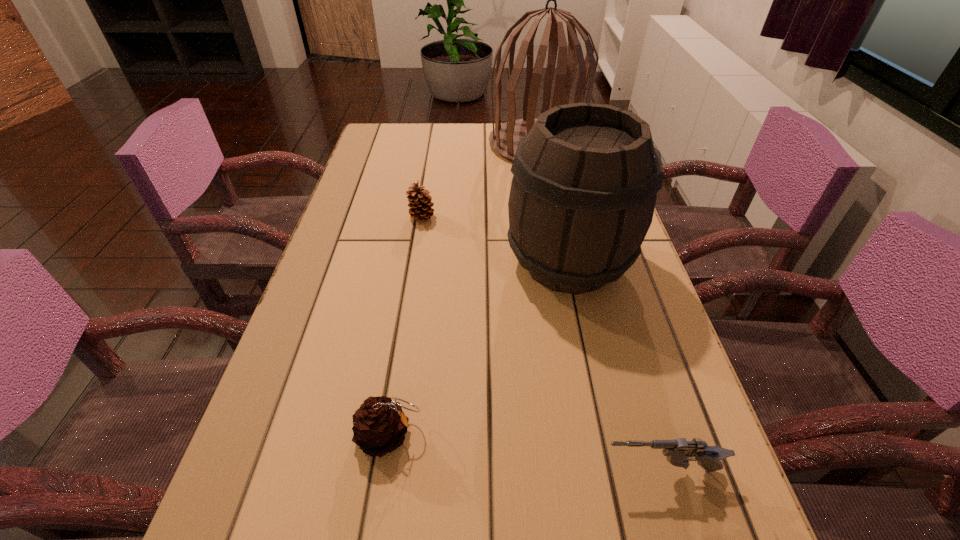
Locate an element on the screen. The width and height of the screenshot is (960, 540). vacant region located at the barrel of the nearest object is located at coordinates (423, 470).

Find the location of a particular element. blank space located at the barrel of the nearest object is located at coordinates (547, 470).

Find the location of `free space located 0.160m at the barrel of the nearest object`. free space located 0.160m at the barrel of the nearest object is located at coordinates pyautogui.click(x=495, y=470).

The height and width of the screenshot is (540, 960). Identify the location of object that is at the far edge. (504, 139).

The image size is (960, 540). In order to click on birdcage located in the right edge section of the desktop in this screenshot , I will do `click(504, 139)`.

At what (x,y) coordinates should I click in order to perform the action: click on wine bucket positioned at the right edge. Please return your answer as a coordinate pair (x, y). Looking at the image, I should click on (582, 198).

What are the coordinates of `gun at the right edge` in the screenshot? It's located at tap(679, 452).

Where is `object at the far right corner`? The height and width of the screenshot is (540, 960). object at the far right corner is located at coordinates (504, 139).

Identify the location of vacant point at the far edge. Image resolution: width=960 pixels, height=540 pixels. (480, 144).

You are a GUI agent. You are given a task and a screenshot of the screen. Output one action in this format:
    pyautogui.click(x=<x>, y=<y>)
    Task: Click on the free space at the left edge of the desktop
    This screenshot has height=540, width=960.
    Given the screenshot: What is the action you would take?
    pyautogui.click(x=398, y=167)